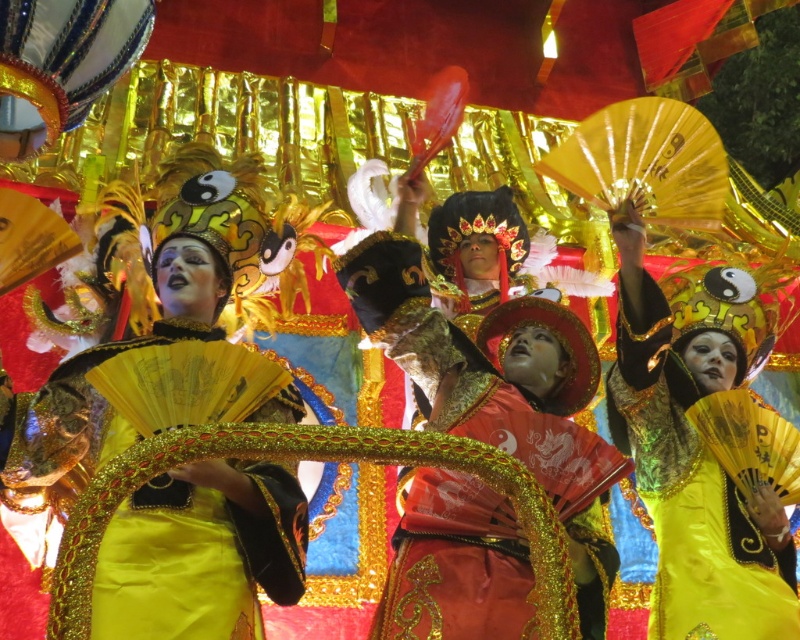
Is point (264, 506) farther from camera compared to point (700, 520)?

That is False.

Who is more forward, (88, 464) or (696, 465)?

Point (88, 464)

Is point (300, 499) positioned before point (738, 593)?

That is True.

Where is `shiny gold fabric at center`? The image size is (800, 640). shiny gold fabric at center is located at coordinates [182, 557].

Can you confirm if shiny gold fabric at center is smaller than shiny red fabric at center?

No.

Is point (285, 547) closer to camera compared to point (528, 432)?

That is True.

Does point (284, 524) come in front of point (409, 595)?

Yes, it is in front of point (409, 595).

Locate an element on the screen. shiny gold fabric at center is located at coordinates (182, 557).

Between shiny yellow fabric at center and shiny red fabric at center, which one appears on the left side from the viewer's perspective?

shiny red fabric at center

Consider the image. Which is below, shiny yellow fabric at center or shiny red fabric at center?

shiny red fabric at center is below.

Which is in front, point (704, 328) or point (446, 474)?

Point (446, 474) is more forward.

Find the location of a particular element. The width and height of the screenshot is (800, 640). shiny yellow fabric at center is located at coordinates (698, 461).